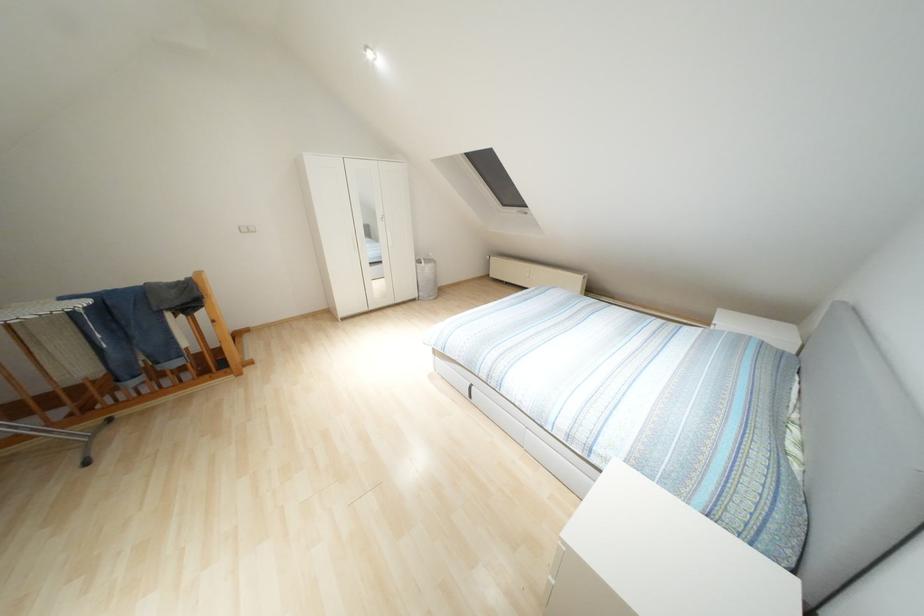
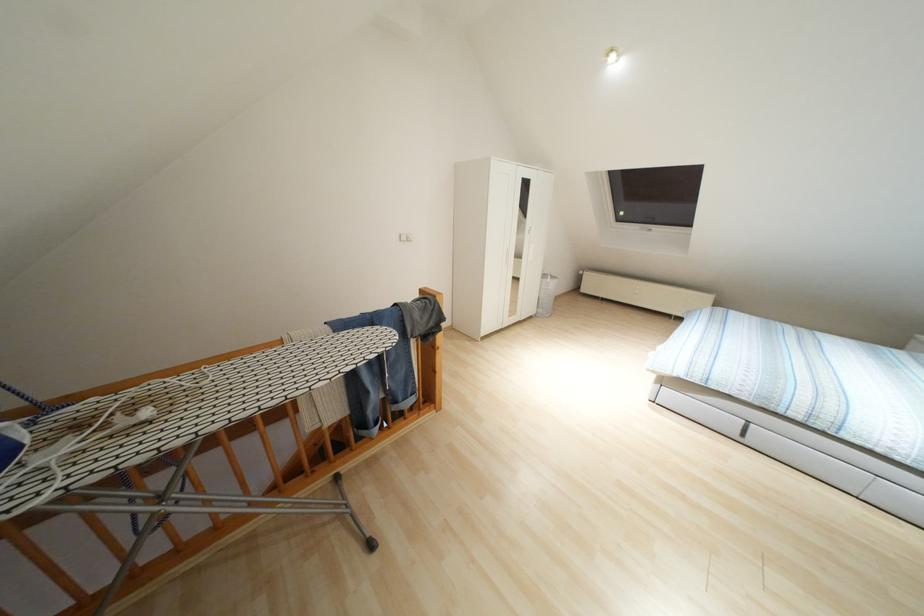
Question: In a continuous first-person perspective shot, in which direction is the camera moving?

Choices:
 (A) Left
 (B) Right
 (C) Forward
 (D) Backward

Answer: (A)